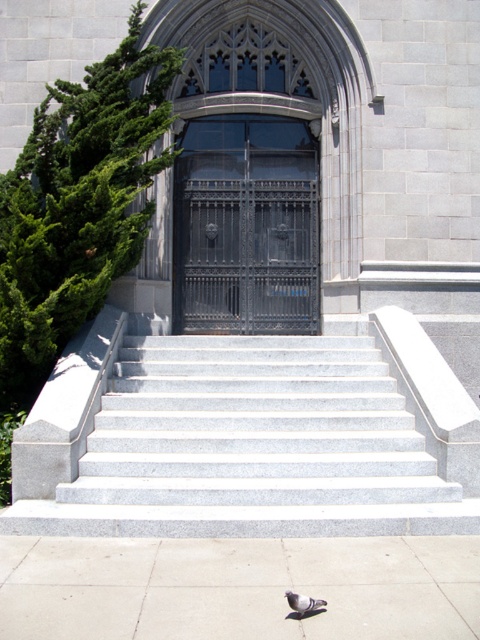
You are standing at the entrance of a church and notice the smooth concrete pavement at lower center. What is the exact coordinate of this pavement according to the image?

The smooth concrete pavement at lower center is located at point (x=239, y=588).

You are a delivery person with a large box that is 2 meters in length. You need to place the box on the smooth concrete pavement at lower center near the black wrought iron door at center. Can the pavement accommodate the box?

The smooth concrete pavement at lower center has a smaller size compared to the black wrought iron door at center. Since the pavement is smaller than the door, it might not have enough space to accommodate a 2 meter long box. Please check the available space carefully before placing the box.

You are a delivery person standing at the entrance of the building. You need to place a heavy box on the ground near the black wrought iron door at center. Where should you place the box to ensure it is on the smooth concrete pavement at lower center?

The smooth concrete pavement at lower center is located below the black wrought iron door at center, so you should place the box directly beneath the black wrought iron door at center on the smooth concrete pavement at lower center.